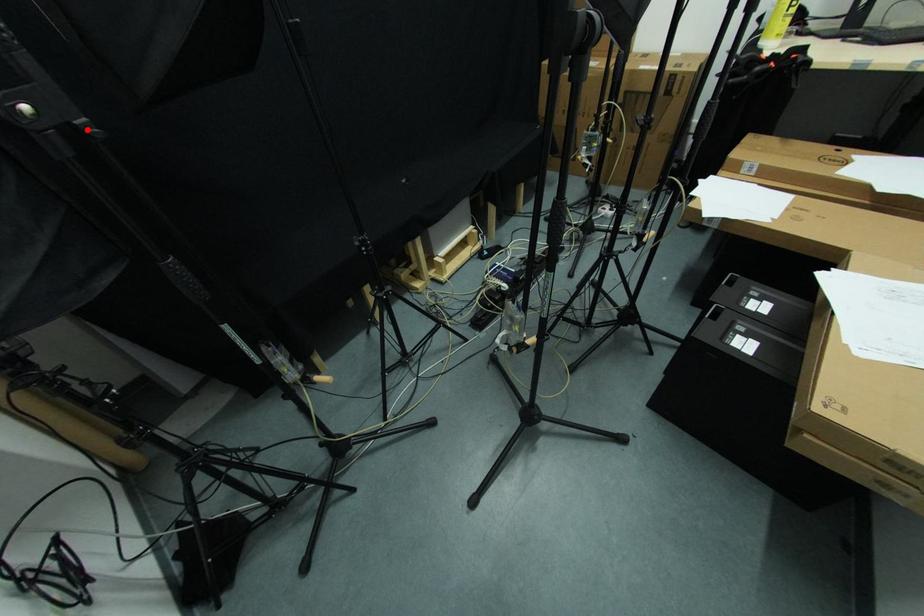
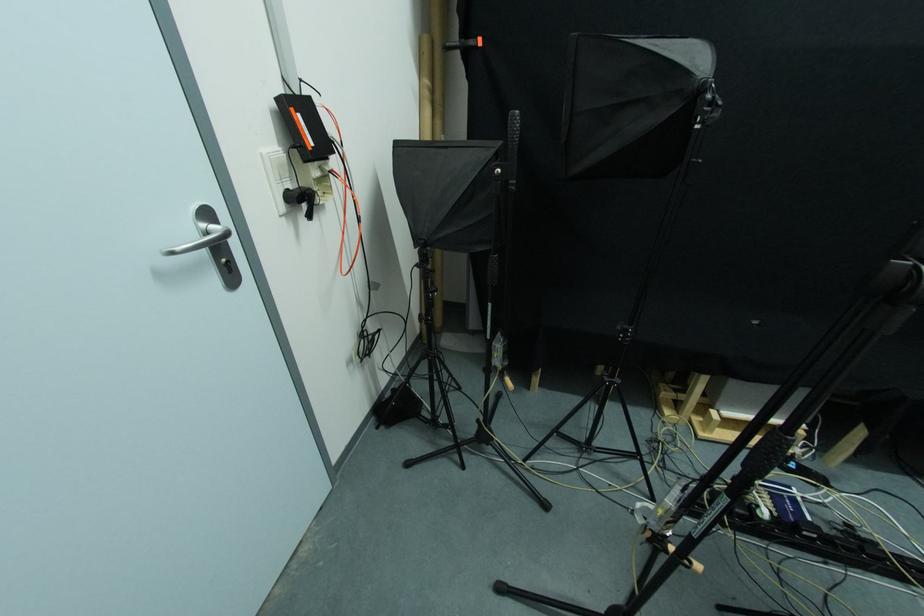
Locate, in the second image, the point that corresponds to the highlighted location in the first image.

(515, 187)